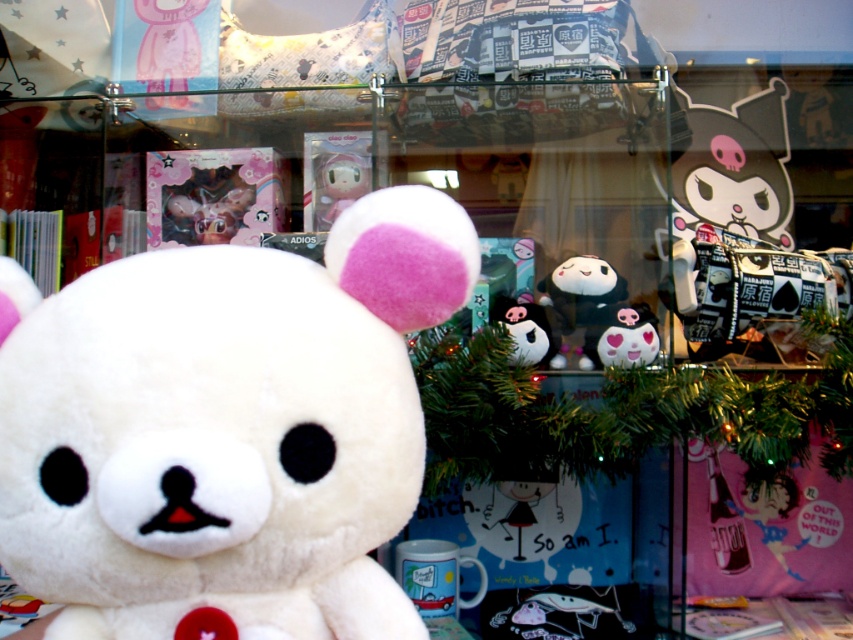
Question: Which point is closer to the camera?

Choices:
 (A) (618, 362)
 (B) (340, 243)
 (C) (532, 339)

Answer: (B)

Question: Which point is closer to the camera?

Choices:
 (A) (613, 342)
 (B) (146, 8)
 (C) (166, 577)
 (D) (517, 310)

Answer: (C)

Question: Does white plush bear at center have a lesser width compared to matte pink plush bear at upper left?

Choices:
 (A) yes
 (B) no

Answer: (B)

Question: Among these points, which one is nearest to the camera?

Choices:
 (A) (331, 586)
 (B) (618, 326)
 (C) (550, 353)

Answer: (A)

Question: Does white plush bear at center have a larger size compared to matte pink plush bear at upper left?

Choices:
 (A) no
 (B) yes

Answer: (B)

Question: Does white plush bear at center appear over matte pink plush bear at upper left?

Choices:
 (A) no
 (B) yes

Answer: (A)